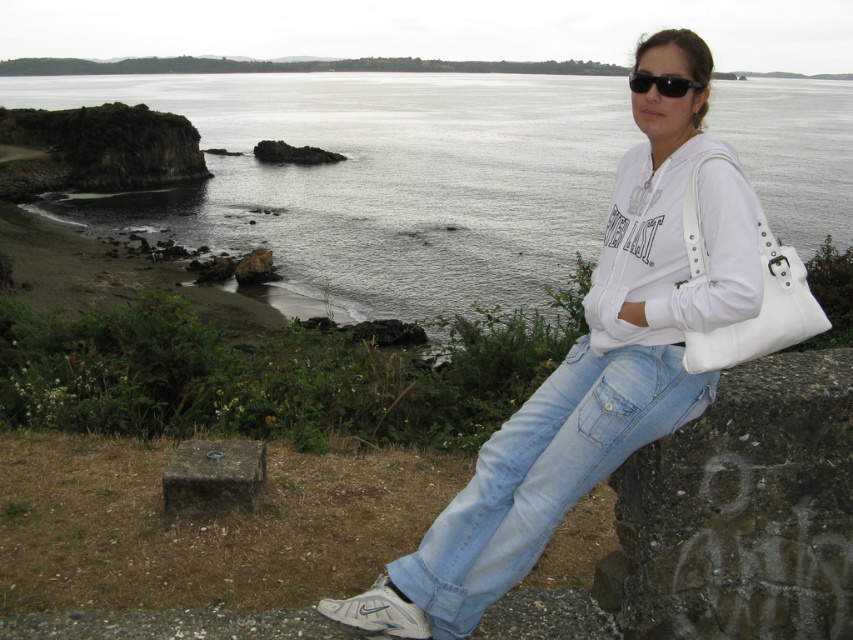
Question: Which object is the farthest from the dark gray stone at lower center?

Choices:
 (A) gray water at upper center
 (B) white matte hoodie at upper right

Answer: (A)

Question: Is white matte hoodie at upper right smaller than light blue denim jeans at lower right?

Choices:
 (A) no
 (B) yes

Answer: (A)

Question: From the image, what is the correct spatial relationship of gray water at upper center in relation to dark gray stone at lower center?

Choices:
 (A) left
 (B) right

Answer: (B)

Question: Estimate the real-world distances between objects in this image. Which object is closer to the light blue denim jeans at lower right?

Choices:
 (A) white matte hoodie at upper right
 (B) gray water at upper center
 (C) dark gray stone at lower center

Answer: (A)

Question: Which point is farther to the camera?

Choices:
 (A) white matte hoodie at upper right
 (B) gray water at upper center
 (C) dark gray stone at lower center
 (D) light blue denim jeans at lower right

Answer: (C)

Question: In this image, where is light blue denim jeans at lower right located relative to dark gray stone at lower center?

Choices:
 (A) above
 (B) below

Answer: (A)